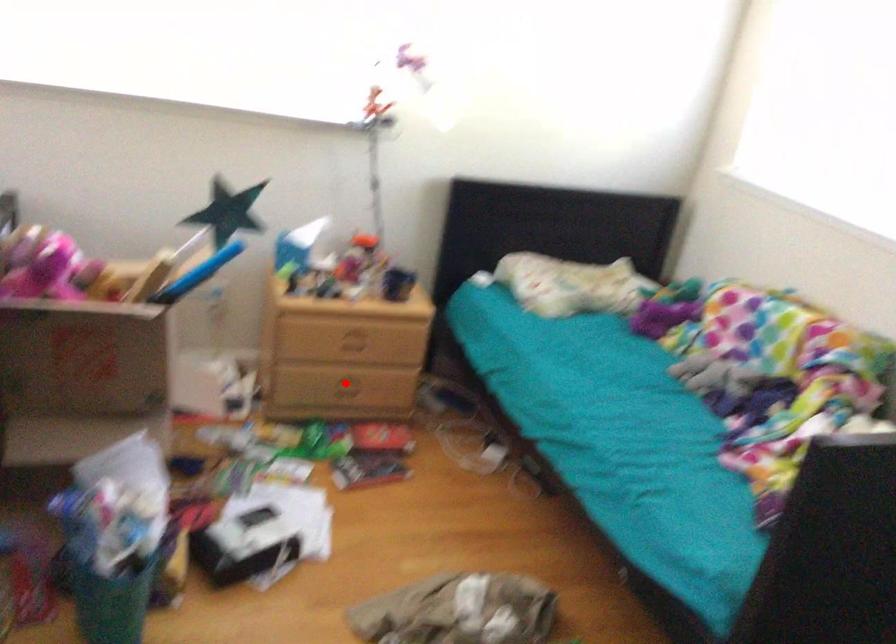
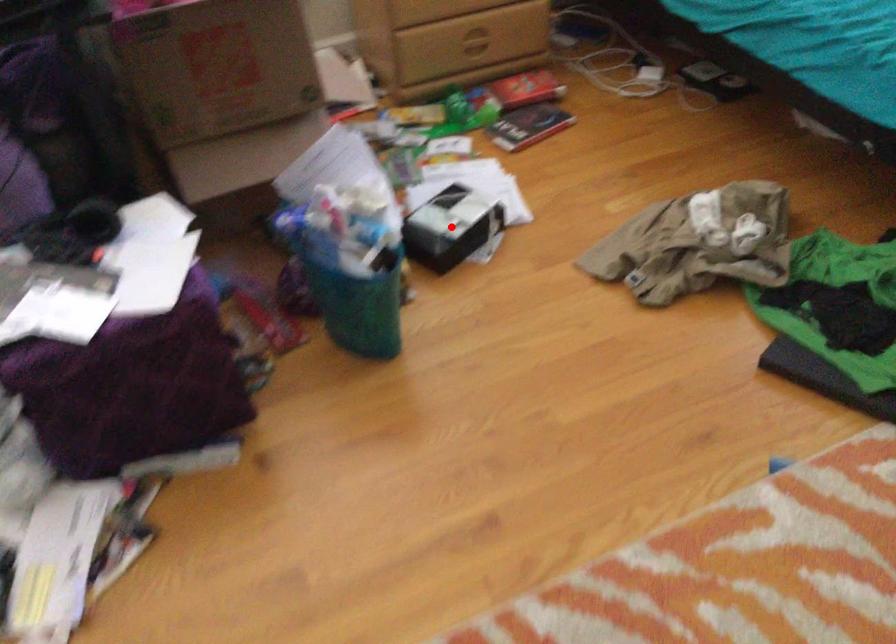
I am providing you with two images of the same scene from different viewpoints. A red point is marked on the first image and another point is marked on the second image. Is the red point in image1 aligned with the point shown in image2?

No